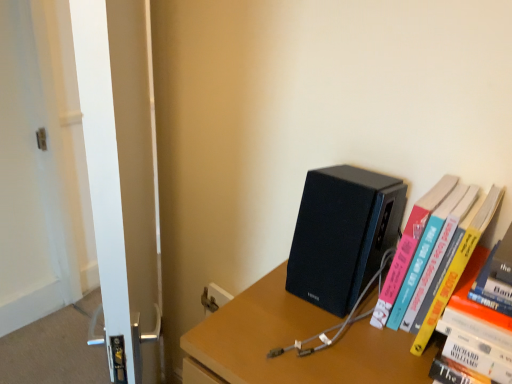
This screenshot has height=384, width=512. What do you see at coordinates (342, 234) in the screenshot?
I see `black matte speaker at center-right` at bounding box center [342, 234].

Identify the location of matte black speaker at upper right. This screenshot has height=384, width=512. (291, 343).

The width and height of the screenshot is (512, 384). Find the location of `hardcover book at right`. hardcover book at right is located at coordinates (457, 267).

This screenshot has width=512, height=384. In order to click on black matte speaker at center-right in this screenshot , I will do `click(342, 234)`.

Does point (376, 217) come farther from viewer compared to point (270, 340)?

Yes, it is.

How far apart are black matte speaker at center-right and matte black speaker at upper right?

12.22 centimeters.

Which of these two, black matte speaker at center-right or matte black speaker at upper right, stands shorter?

With less height is black matte speaker at center-right.

Does black matte speaker at center-right turn towards matte black speaker at upper right?

No, black matte speaker at center-right is not turned towards matte black speaker at upper right.

Are white glossy screen door at left and matte black speaker at upper right making contact?

There is a gap between white glossy screen door at left and matte black speaker at upper right.

From the image's perspective, which is below, white glossy screen door at left or matte black speaker at upper right?

matte black speaker at upper right, from the image's perspective.

Who is more distant, white glossy screen door at left or matte black speaker at upper right?

white glossy screen door at left is further from the camera.

Considering the relative sizes of white glossy screen door at left and matte black speaker at upper right in the image provided, is white glossy screen door at left taller than matte black speaker at upper right?

Indeed, white glossy screen door at left has a greater height compared to matte black speaker at upper right.

What's the angular difference between white glossy screen door at left and hardcover book at right's facing directions?

white glossy screen door at left and hardcover book at right are facing 44 degrees away from each other.

Are white glossy screen door at left and hardcover book at right far apart?

That's not correct — white glossy screen door at left is a little close to hardcover book at right.

Which is farther, (147, 284) or (448, 284)?

The point (147, 284) is behind.

From the image's perspective, is white glossy screen door at left beneath hardcover book at right?

Yes, from the image's perspective, white glossy screen door at left is beneath hardcover book at right.

Considering the positions of objects matte black speaker at upper right and hardcover book at right in the image provided, who is behind, matte black speaker at upper right or hardcover book at right?

Positioned behind is hardcover book at right.

Is matte black speaker at upper right inside the boundaries of hardcover book at right, or outside?

matte black speaker at upper right is located beyond the bounds of hardcover book at right.

Does matte black speaker at upper right turn towards hardcover book at right?

No, matte black speaker at upper right is not aimed at hardcover book at right.

Considering the sizes of matte black speaker at upper right and black matte speaker at center-right in the image, is matte black speaker at upper right taller or shorter than black matte speaker at center-right?

matte black speaker at upper right is taller than black matte speaker at center-right.

Which of these two, matte black speaker at upper right or black matte speaker at center-right, is smaller?

With smaller size is black matte speaker at center-right.

Is black matte speaker at center-right at the back of matte black speaker at upper right?

No.

The image size is (512, 384). Find the location of `desk to the left of black matte speaker at center-right`. desk to the left of black matte speaker at center-right is located at coordinates (291, 343).

Between hardcover book at right and white glossy screen door at left, which one is positioned in front?

Positioned in front is white glossy screen door at left.

Is hardcover book at right bigger than white glossy screen door at left?

No, hardcover book at right is not bigger than white glossy screen door at left.

This screenshot has height=384, width=512. Identify the location of book that appears above the white glossy screen door at left (from the image's perspective). (457, 267).

Is white glossy screen door at left at the back of hardcover book at right?

No, hardcover book at right is not facing away from white glossy screen door at left.

Can you tell me how much white glossy screen door at left and black matte speaker at center-right differ in facing direction?

white glossy screen door at left and black matte speaker at center-right are facing 44 degrees away from each other.

Consider the image. Is white glossy screen door at left turned away from black matte speaker at center-right?

That's right, white glossy screen door at left is facing away from black matte speaker at center-right.

From the picture: Can black matte speaker at center-right be found inside white glossy screen door at left?

No, black matte speaker at center-right is not inside white glossy screen door at left.

Locate an element on the screen. desk on the left of black matte speaker at center-right is located at coordinates (291, 343).

Image resolution: width=512 pixels, height=384 pixels. Identify the location of screen door that appears above the matte black speaker at upper right (from a real-world perspective). click(x=122, y=170).

Looking at this image, from the image, which object appears to be farther from hardcover book at right, matte black speaker at upper right or black matte speaker at center-right?

Based on the image, matte black speaker at upper right appears to be further to hardcover book at right.

Looking at the image, which one is located closer to matte black speaker at upper right, white glossy screen door at left or black matte speaker at center-right?

Among the two, black matte speaker at center-right is located nearer to matte black speaker at upper right.

Consider the image. When comparing their distances from hardcover book at right, does black matte speaker at center-right or matte black speaker at upper right seem further?

matte black speaker at upper right lies further to hardcover book at right than the other object.

Based on their spatial positions, is matte black speaker at upper right or white glossy screen door at left further from black matte speaker at center-right?

white glossy screen door at left is further to black matte speaker at center-right.

Based on their spatial positions, is black matte speaker at center-right or matte black speaker at upper right closer to white glossy screen door at left?

matte black speaker at upper right.

When comparing their distances from white glossy screen door at left, does black matte speaker at center-right or hardcover book at right seem closer?

black matte speaker at center-right lies closer to white glossy screen door at left than the other object.

Considering their positions, is hardcover book at right positioned further to matte black speaker at upper right than black matte speaker at center-right?

hardcover book at right lies further to matte black speaker at upper right than the other object.

Considering their positions, is black matte speaker at center-right positioned closer to hardcover book at right than white glossy screen door at left?

The object closer to hardcover book at right is black matte speaker at center-right.

This screenshot has width=512, height=384. In order to click on computer between white glossy screen door at left and hardcover book at right from left to right in this screenshot , I will do `click(342, 234)`.

The width and height of the screenshot is (512, 384). I want to click on book between black matte speaker at center-right and matte black speaker at upper right in the up-down direction, so click(457, 267).

Identify the location of desk between white glossy screen door at left and black matte speaker at center-right. The width and height of the screenshot is (512, 384). (291, 343).

The height and width of the screenshot is (384, 512). I want to click on desk between white glossy screen door at left and hardcover book at right from left to right, so click(x=291, y=343).